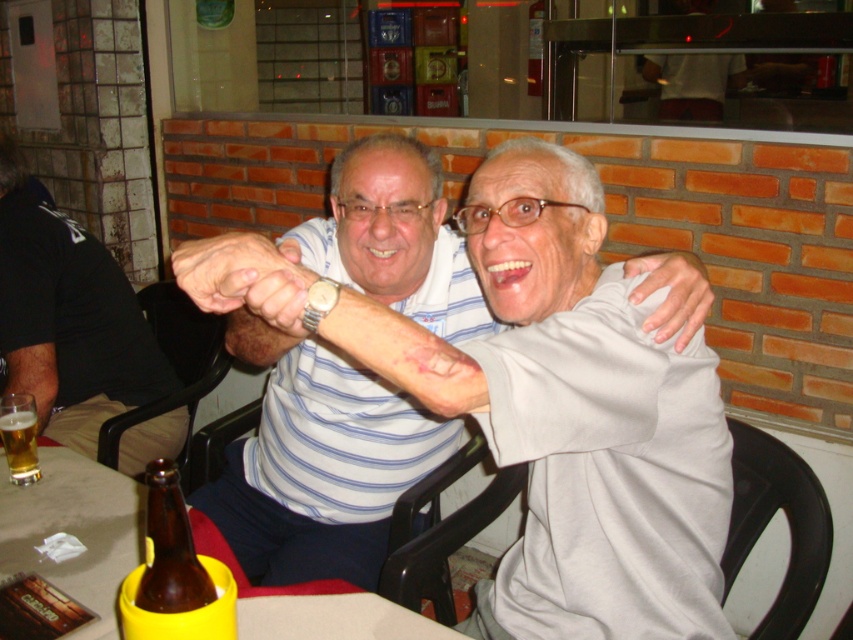
Does smooth plastic table at center have a greater height compared to translucent glass mug at table left?

Yes, smooth plastic table at center is taller than translucent glass mug at table left.

Does smooth plastic table at center have a lesser height compared to translucent glass mug at table left?

Incorrect, smooth plastic table at center's height does not fall short of translucent glass mug at table left's.

Identify the location of smooth plastic table at center. (73, 531).

Does brown glass bottle at lower left appear on the right side of translucent glass mug at table left?

Yes, brown glass bottle at lower left is to the right of translucent glass mug at table left.

Can you confirm if brown glass bottle at lower left is bigger than translucent glass mug at table left?

Correct, brown glass bottle at lower left is larger in size than translucent glass mug at table left.

What do you see at coordinates (169, 548) in the screenshot? I see `brown glass bottle at lower left` at bounding box center [169, 548].

Identify the location of brown glass bottle at lower left. (169, 548).

Is matte black shirt at left shorter than smooth plastic table at center?

No, matte black shirt at left is not shorter than smooth plastic table at center.

Does matte black shirt at left appear under smooth plastic table at center?

Incorrect, matte black shirt at left is not positioned below smooth plastic table at center.

Between point (35, 292) and point (364, 618), which one is positioned in front?

Point (364, 618) is in front.

The image size is (853, 640). In order to click on matte black shirt at left in this screenshot , I will do 68,320.